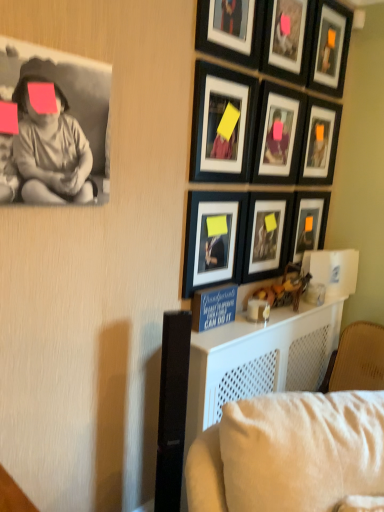
Question: Is black matte picture frame at upper center, acting as the third picture frame starting from the top, positioned behind matte black picture frame at upper center, the sixth picture frame when ordered from top to bottom?

Choices:
 (A) yes
 (B) no

Answer: (B)

Question: Considering the relative positions of black matte picture frame at upper center, which ranks as the 7th picture frame in bottom-to-top order, and matte black picture frame at upper center, arranged as the fourth picture frame when ordered from the bottom, in the image provided, is black matte picture frame at upper center, which ranks as the 7th picture frame in bottom-to-top order, in front of matte black picture frame at upper center, arranged as the fourth picture frame when ordered from the bottom,?

Choices:
 (A) no
 (B) yes

Answer: (B)

Question: Considering the relative positions of black matte picture frame at upper center, acting as the third picture frame starting from the top, and matte black picture frame at upper center, the sixth picture frame when ordered from top to bottom, in the image provided, is black matte picture frame at upper center, acting as the third picture frame starting from the top, to the left of matte black picture frame at upper center, the sixth picture frame when ordered from top to bottom, from the viewer's perspective?

Choices:
 (A) yes
 (B) no

Answer: (B)

Question: From a real-world perspective, does black matte picture frame at upper center, which ranks as the 7th picture frame in bottom-to-top order, stand above matte black picture frame at upper center, arranged as the fourth picture frame when ordered from the bottom?

Choices:
 (A) no
 (B) yes

Answer: (B)

Question: From the image's perspective, is black matte picture frame at upper center, which ranks as the 7th picture frame in bottom-to-top order, under matte black picture frame at upper center, the sixth picture frame when ordered from top to bottom?

Choices:
 (A) yes
 (B) no

Answer: (B)

Question: Could you tell me if black matte picture frame at upper center, acting as the third picture frame starting from the top, is turned towards matte black picture frame at upper center, the sixth picture frame when ordered from top to bottom?

Choices:
 (A) yes
 (B) no

Answer: (B)

Question: From the image's perspective, is matte black picture frame at center-right, placed as the 3th picture frame when sorted from bottom to top, over matte black picture frame at center, positioned as the second picture frame in bottom-to-top order?

Choices:
 (A) yes
 (B) no

Answer: (A)

Question: Is matte black picture frame at center-right, placed as the 3th picture frame when sorted from bottom to top, aimed at matte black picture frame at center, acting as the 8th picture frame starting from the top?

Choices:
 (A) no
 (B) yes

Answer: (A)

Question: Is matte black picture frame at center-right, placed as the 3th picture frame when sorted from bottom to top, thinner than matte black picture frame at center, positioned as the second picture frame in bottom-to-top order?

Choices:
 (A) no
 (B) yes

Answer: (B)

Question: Is matte black picture frame at center-right, placed as the 3th picture frame when sorted from bottom to top, beside matte black picture frame at center, positioned as the second picture frame in bottom-to-top order?

Choices:
 (A) no
 (B) yes

Answer: (A)

Question: Is matte black picture frame at center-right, placed as the 3th picture frame when sorted from bottom to top, to the right of matte black picture frame at center, positioned as the second picture frame in bottom-to-top order, from the viewer's perspective?

Choices:
 (A) yes
 (B) no

Answer: (A)

Question: Is matte black picture frame at center-right, placed as the 3th picture frame when sorted from bottom to top, not near matte black picture frame at center, positioned as the second picture frame in bottom-to-top order?

Choices:
 (A) yes
 (B) no

Answer: (B)

Question: Can you confirm if matte black picture frame at center, acting as the 8th picture frame starting from the top, is shorter than matte black picture frame at upper center, positioned as the 5th picture frame in top-to-bottom order?

Choices:
 (A) no
 (B) yes

Answer: (A)